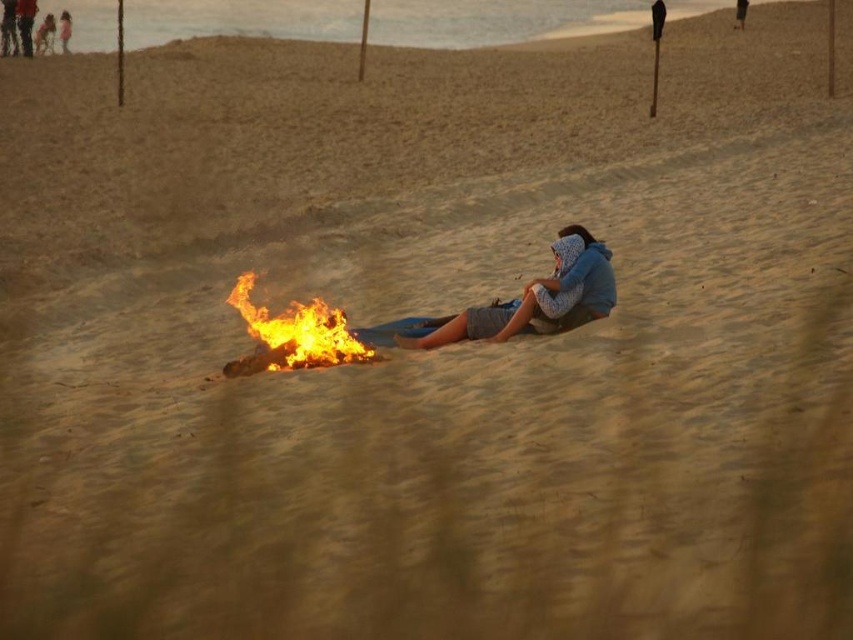
You are a photographer trying to capture both the blue cotton hoodie at center and the dark blue jeans at upper left in a single shot. Based on their positions, which object should you focus on first to ensure both are in frame?

The blue cotton hoodie at center is positioned closer to the photographer than the dark blue jeans at upper left, so focusing on the blue cotton hoodie at center first would ensure both are in frame.